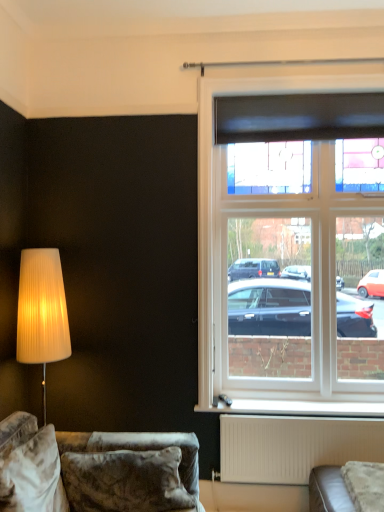
The image size is (384, 512). What are the coordinates of `free spot above white plastic window sill at lower center (from a real-world perspective)` in the screenshot? It's located at (296, 403).